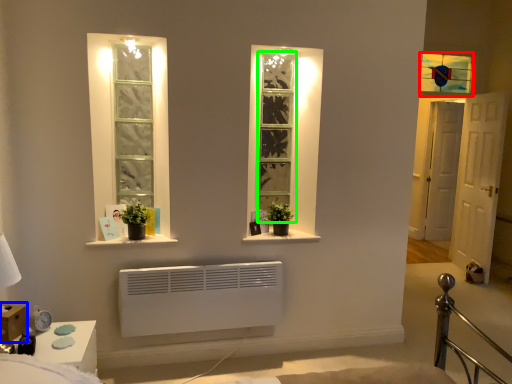
Question: Which object is the closest to the window (highlighted by a red box)? Choose among these: window box (highlighted by a blue box) or bay window (highlighted by a green box).

Choices:
 (A) window box
 (B) bay window

Answer: (B)